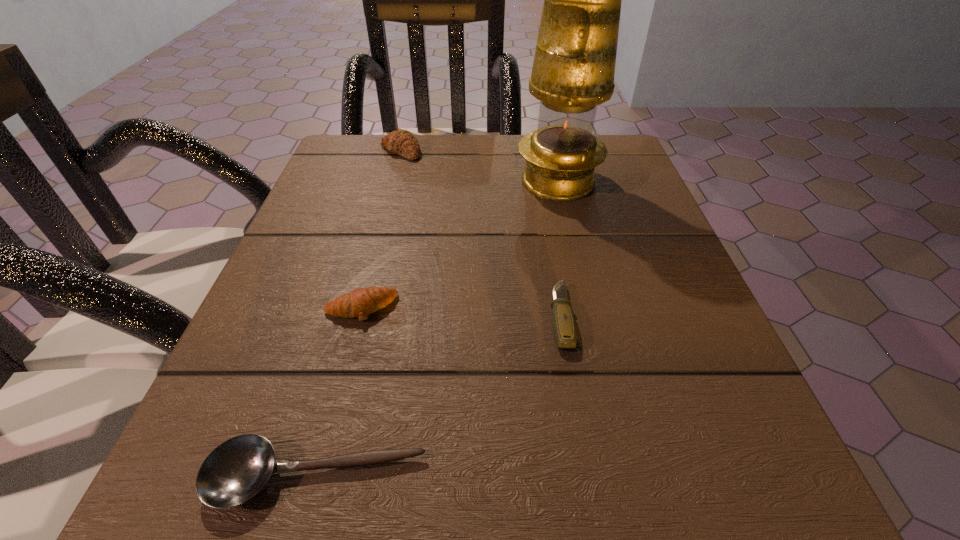
Find the location of `oil lamp`. oil lamp is located at coordinates (573, 71).

This screenshot has height=540, width=960. Identify the location of the second tallest object. (402, 142).

I want to click on the taller crescent roll, so click(x=402, y=142).

Where is `the nearer crescent roll`? The width and height of the screenshot is (960, 540). the nearer crescent roll is located at coordinates (361, 302).

Where is `the third shortest object`? This screenshot has height=540, width=960. the third shortest object is located at coordinates (361, 302).

This screenshot has height=540, width=960. I want to click on pocketknife, so click(563, 321).

This screenshot has height=540, width=960. I want to click on the nearest object, so click(235, 471).

You are a GUI agent. You are given a task and a screenshot of the screen. Output one action in this format:
    pyautogui.click(x=<x>, y=<y>)
    Task: Click on the blank space located on the front of the tallest object
    Image resolution: width=960 pixels, height=540 pixels.
    Given the screenshot: What is the action you would take?
    pyautogui.click(x=567, y=221)

Where is `vacant space located on the right of the farther crescent roll`? This screenshot has width=960, height=540. vacant space located on the right of the farther crescent roll is located at coordinates (497, 152).

The image size is (960, 540). What are the coordinates of `free spot located on the right of the shorter crescent roll` in the screenshot? It's located at (585, 308).